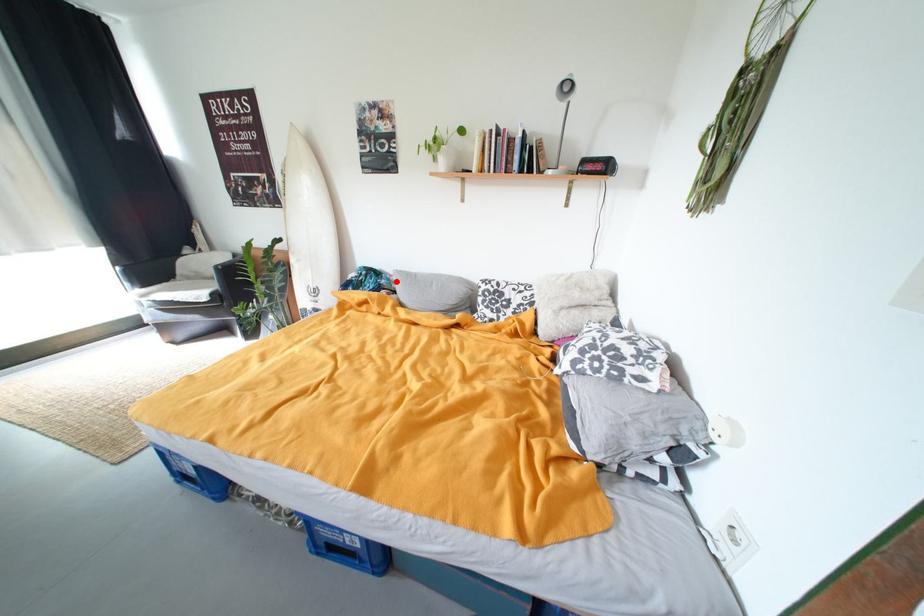
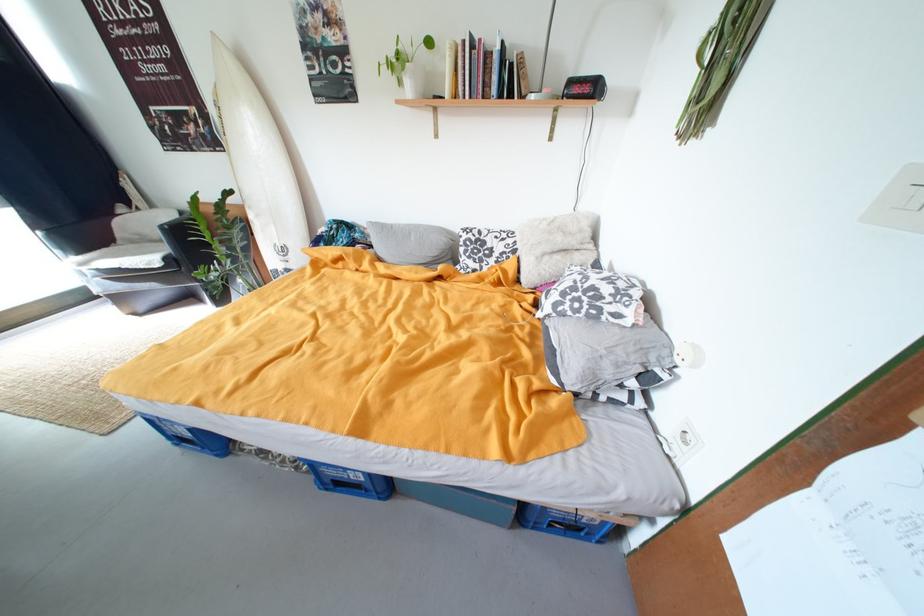
Question: I am providing you with two images of the same scene from different viewpoints. A red point is marked on the first image. Can you still see the location of the red point in image 2?

Choices:
 (A) Yes
 (B) No

Answer: (A)